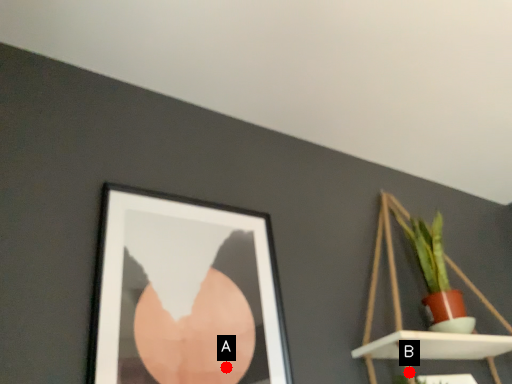
Question: Two points are circled on the image, labeled by A and B beside each circle. Which point appears farthest from the camera in this image?

Choices:
 (A) A is further
 (B) B is further

Answer: (B)